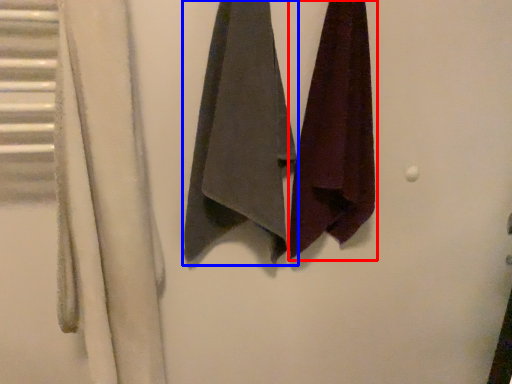
Question: Among these objects, which one is nearest to the camera, towel (highlighted by a red box) or towel (highlighted by a blue box)?

Choices:
 (A) towel
 (B) towel

Answer: (B)